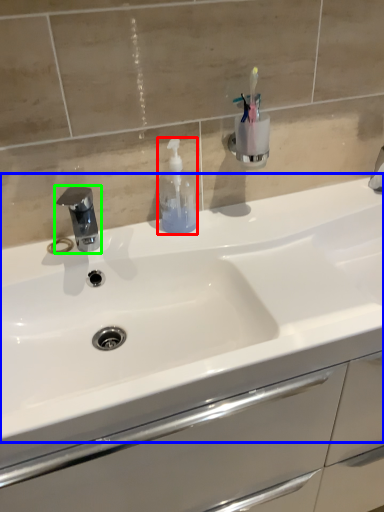
Question: Which object is positioned farthest from soap dispenser (highlighted by a red box)? Select from sink (highlighted by a blue box) and tap (highlighted by a green box).

Choices:
 (A) sink
 (B) tap

Answer: (A)